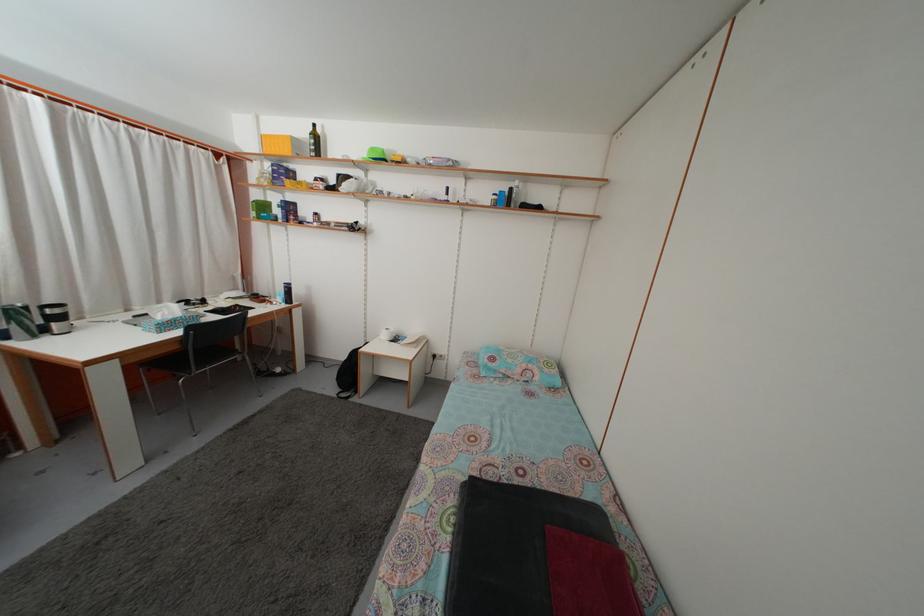
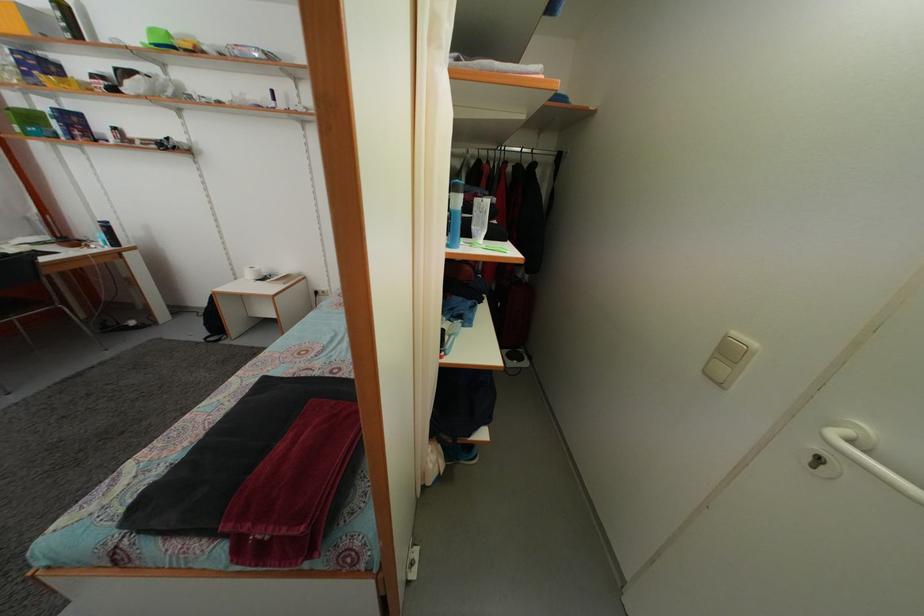
Question: The images are taken continuously from a first-person perspective. In which direction are you moving?

Choices:
 (A) Left
 (B) Right
 (C) Forward
 (D) Backward

Answer: (B)